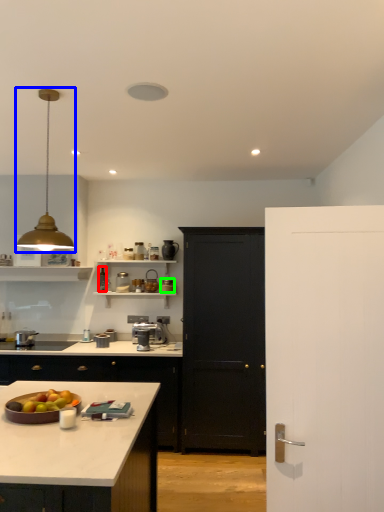
Question: Which object is the farthest from appliance (highlighted by a red box)? Choose among these: light fixture (highlighted by a blue box) or appliance (highlighted by a green box).

Choices:
 (A) light fixture
 (B) appliance

Answer: (A)